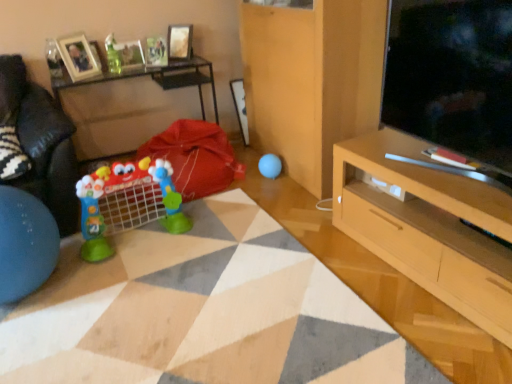
Where is `unoccupied region to the right of plastic toy at center, the second toy from the right`? unoccupied region to the right of plastic toy at center, the second toy from the right is located at coordinates (211, 232).